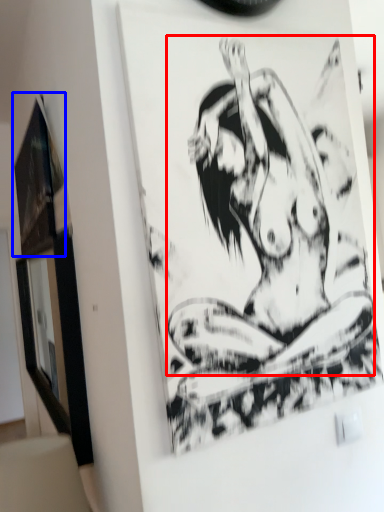
Question: Which point is closer to the camera, person (highlighted by a red box) or picture frame (highlighted by a blue box)?

Choices:
 (A) person
 (B) picture frame

Answer: (A)